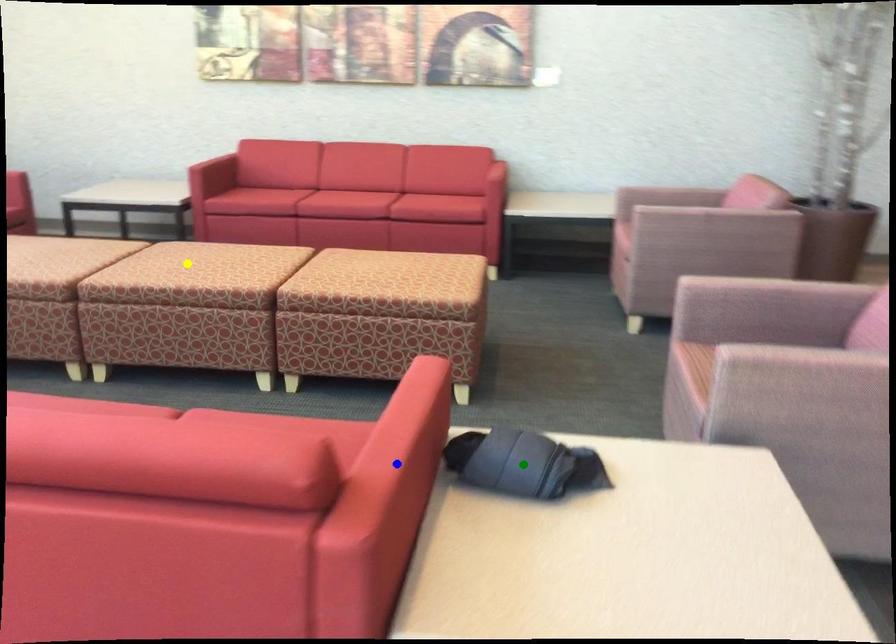
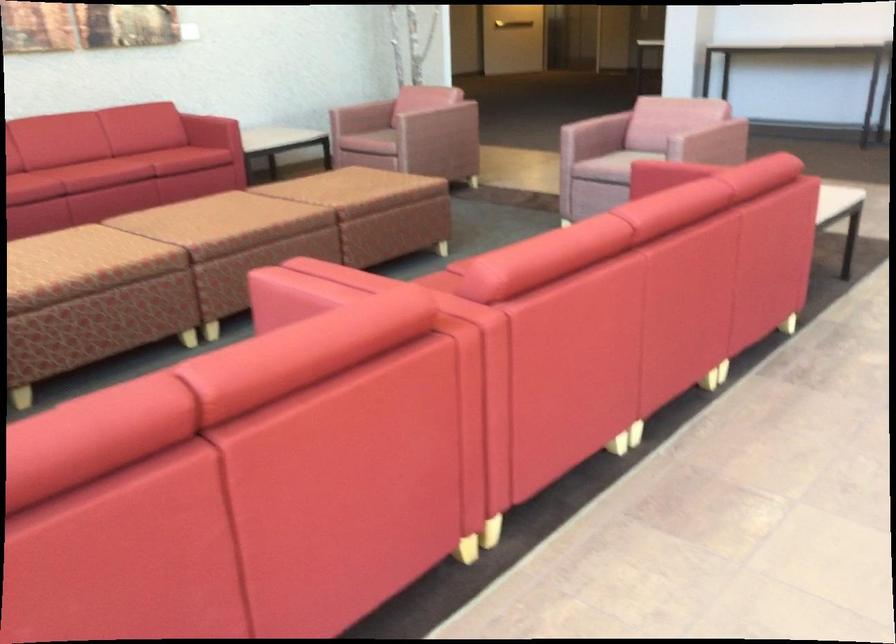
I am providing you with two images of the same scene from different viewpoints. Three points are marked in image1. Which point corresponds to a part or object that is occluded in image2?In image1, three points are marked. Which of them correspond to a part or object that is occluded in image2?Among the three points shown in image1, which one corresponds to a part or object that is no longer visible due to occlusion in image2?

Invisible in image2: green point, yellow point, blue point.